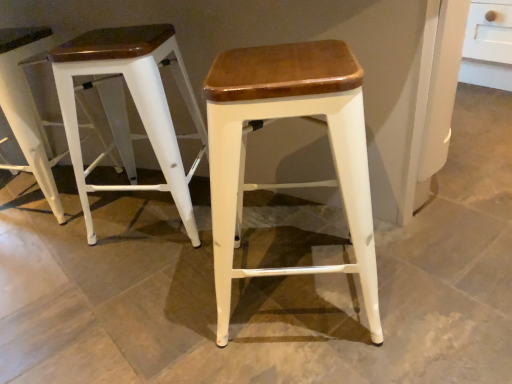
Question: Is white matte stool at left, which is the 1th stool from left to right, taller or shorter than white matte stool at left, which is counted as the 2th stool, starting from the right?

Choices:
 (A) tall
 (B) short

Answer: (A)

Question: Which is correct: white matte stool at left, acting as the 3th stool starting from the right, is inside white matte stool at left, which is counted as the second stool, starting from the left, or outside of it?

Choices:
 (A) outside
 (B) inside

Answer: (A)

Question: Which object is positioned farthest from the white wood stool at center, the third stool when ordered from left to right?

Choices:
 (A) white matte stool at left, acting as the 3th stool starting from the right
 (B) white matte stool at left, which is counted as the second stool, starting from the left

Answer: (A)

Question: Which object is the closest to the white matte stool at left, which is counted as the 2th stool, starting from the right?

Choices:
 (A) white matte stool at left, which is the 1th stool from left to right
 (B) white wood stool at center, the 1th stool viewed from the right

Answer: (A)